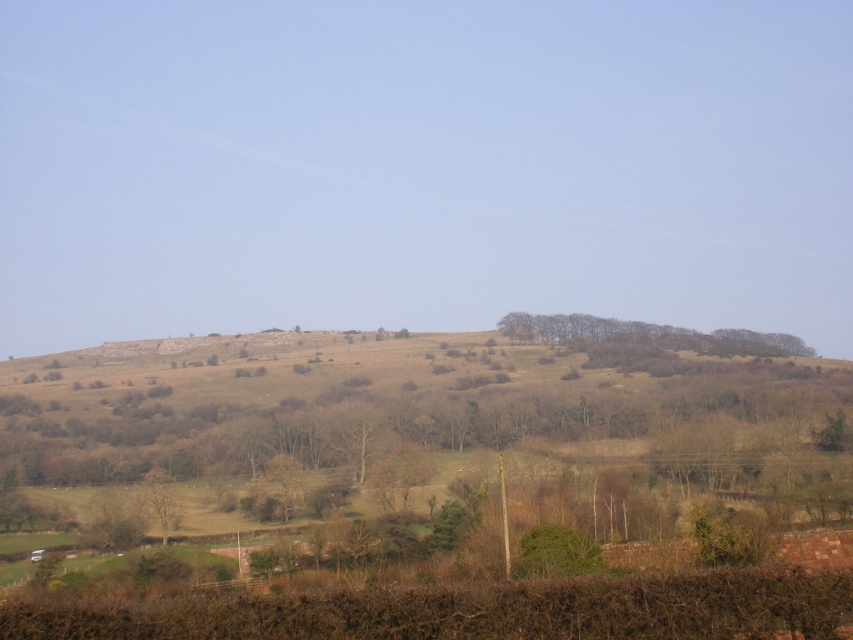
Is brown textured trees at center thinner than brown textured tree at lower left?

In fact, brown textured trees at center might be wider than brown textured tree at lower left.

Who is more forward, (590,332) or (155,470)?

Point (155,470)

Find the location of a particular element. The height and width of the screenshot is (640, 853). brown textured trees at center is located at coordinates (648, 333).